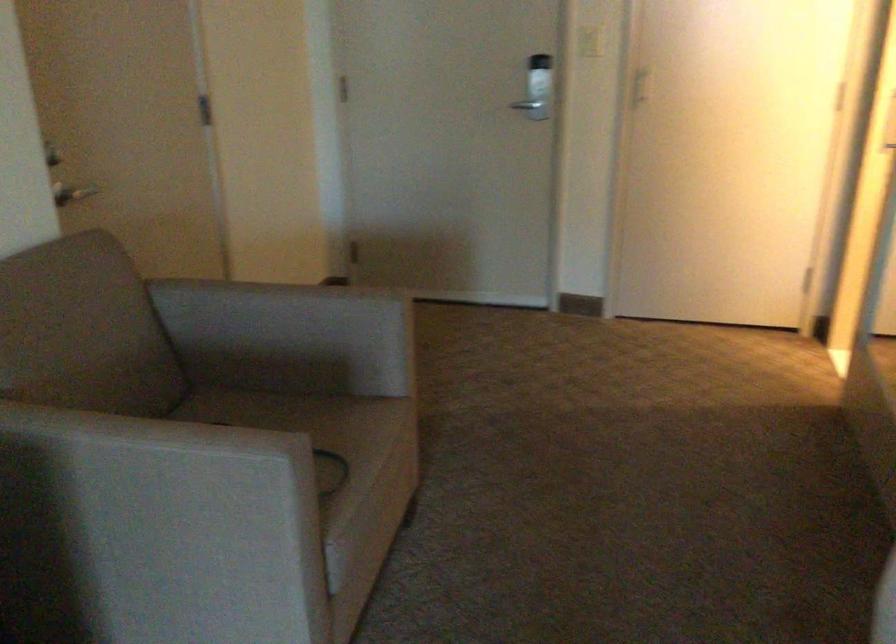
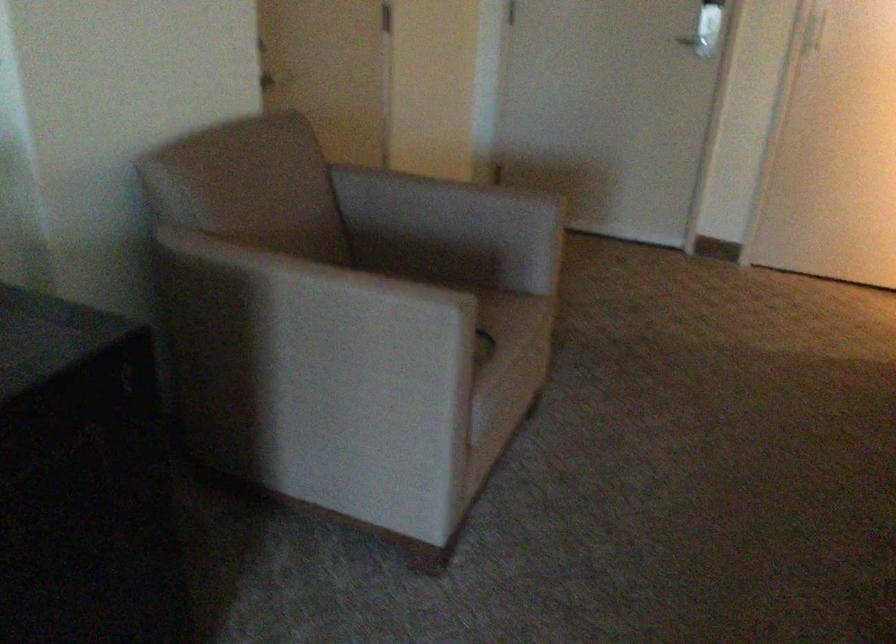
What movement of the cameraman would produce the second image?

The movement direction of the cameraman is left, backward.